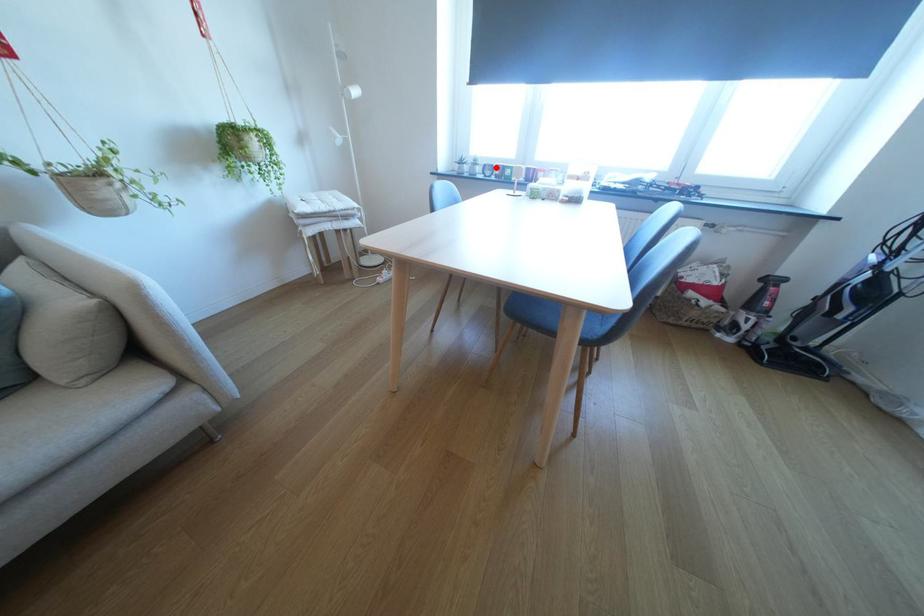
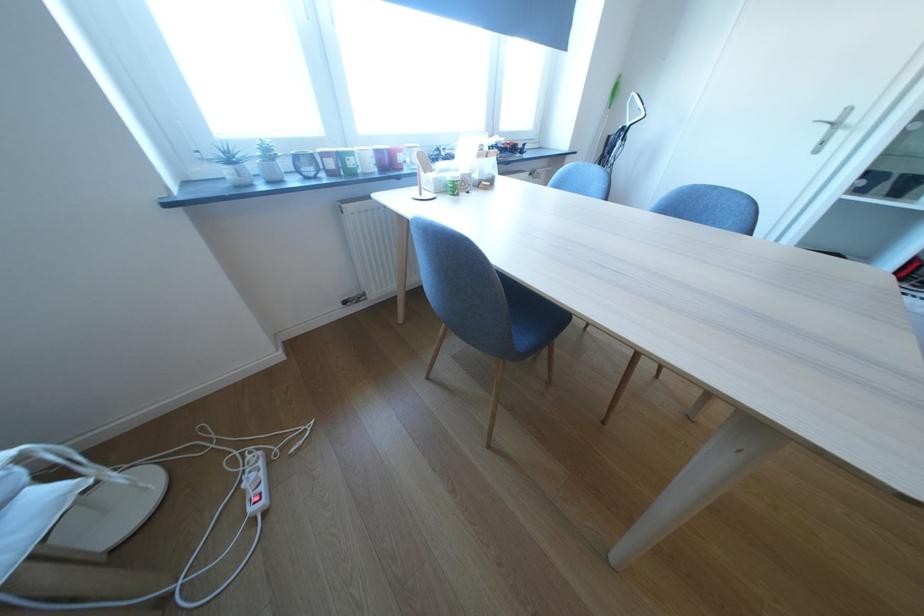
The point at the highlighted location is marked in the first image. Where is the corresponding point in the second image?

(308, 160)